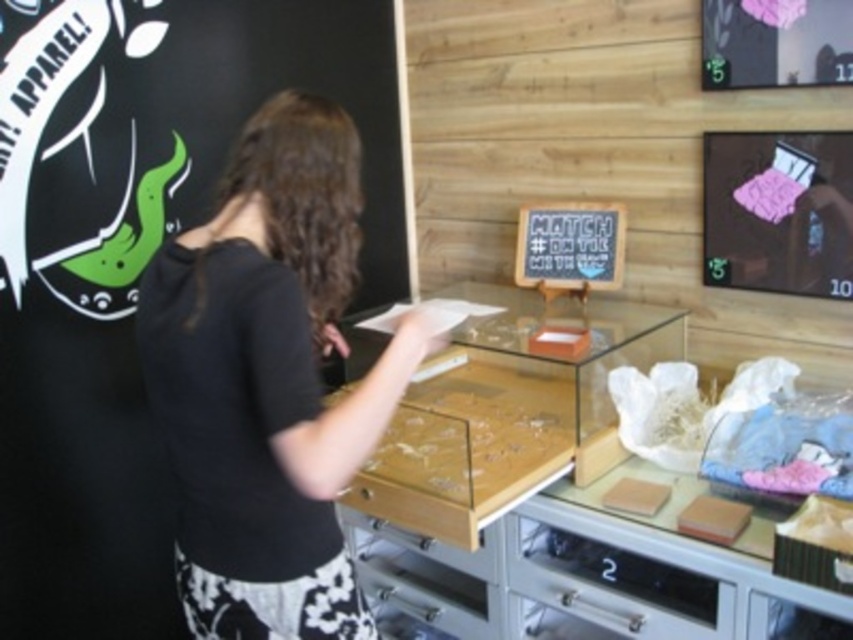
Question: Which point is farther to the camera?

Choices:
 (A) (318, 612)
 (B) (723, 131)

Answer: (B)

Question: Can you confirm if pink fabric bed at upper right is bigger than metallic silver drawer at lower center?

Choices:
 (A) no
 (B) yes

Answer: (A)

Question: Considering the real-world distances, which object is closest to the metallic silver drawer at lower center?

Choices:
 (A) pink fabric bed at upper right
 (B) black chalkboard at center
 (C) black matte shirt at center

Answer: (C)

Question: Is the position of pink fabric bed at upper right less distant than that of black chalkboard at center?

Choices:
 (A) no
 (B) yes

Answer: (B)

Question: Is pink fabric bed at upper right above black chalkboard at center?

Choices:
 (A) no
 (B) yes

Answer: (B)

Question: Which point appears closest to the camera in this image?

Choices:
 (A) (552, 278)
 (B) (720, 580)
 (C) (844, 196)
 (D) (192, 356)

Answer: (D)